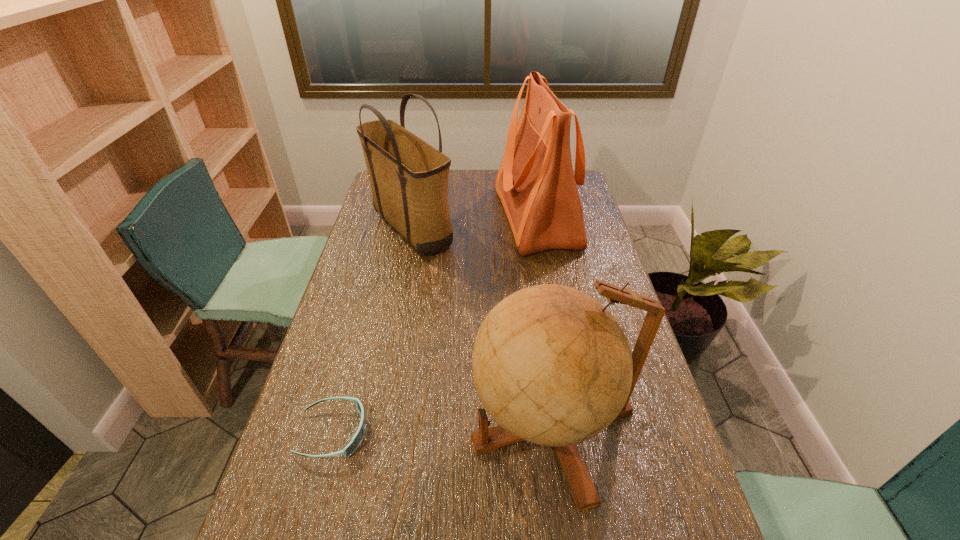
The width and height of the screenshot is (960, 540). Find the location of `blank region between the shopping bag and the shortest object`. blank region between the shopping bag and the shortest object is located at coordinates pyautogui.click(x=435, y=325).

The height and width of the screenshot is (540, 960). I want to click on free space between the shortest object and the shopping bag, so click(x=435, y=325).

Find the location of `vacant space that's between the globe and the shortest object`. vacant space that's between the globe and the shortest object is located at coordinates (444, 429).

Identify which object is the nearest to the globe. Please provide its 2D coordinates. Your answer should be formatted as a tuple, i.e. [(x, y)], where the tuple contains the x and y coordinates of a point satisfying the conditions above.

[(356, 440)]

Choose which object is the third nearest neighbor to the tote bag. Please provide its 2D coordinates. Your answer should be formatted as a tuple, i.e. [(x, y)], where the tuple contains the x and y coordinates of a point satisfying the conditions above.

[(356, 440)]